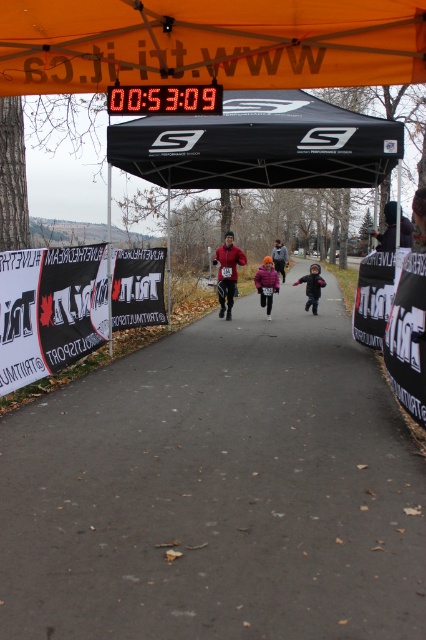
In the scene shown: Between black fabric canopy at upper center and matte purple jacket at center, which one is positioned lower?

Positioned lower is matte purple jacket at center.

Describe the element at coordinates (259, 145) in the screenshot. The height and width of the screenshot is (640, 426). I see `black fabric canopy at upper center` at that location.

Image resolution: width=426 pixels, height=640 pixels. I want to click on black fabric canopy at upper center, so click(259, 145).

This screenshot has height=640, width=426. Identify the location of gray asphalt path at center. (218, 490).

Who is taller, gray asphalt path at center or orange fabric canopy at upper center?

gray asphalt path at center is taller.

Who is higher up, gray asphalt path at center or orange fabric canopy at upper center?

orange fabric canopy at upper center

I want to click on gray asphalt path at center, so click(218, 490).